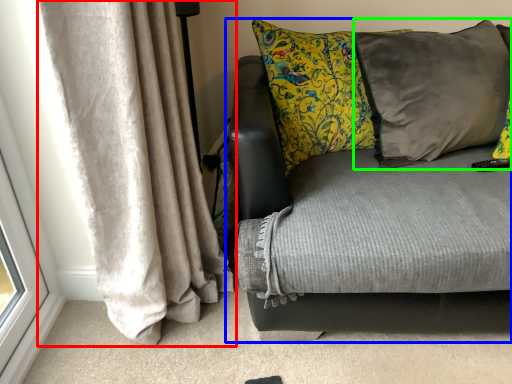
Question: Estimate the real-world distances between objects in this image. Which object is closer to curtain (highlighted by a red box), studio couch (highlighted by a blue box) or pillow (highlighted by a green box)?

Choices:
 (A) studio couch
 (B) pillow

Answer: (A)